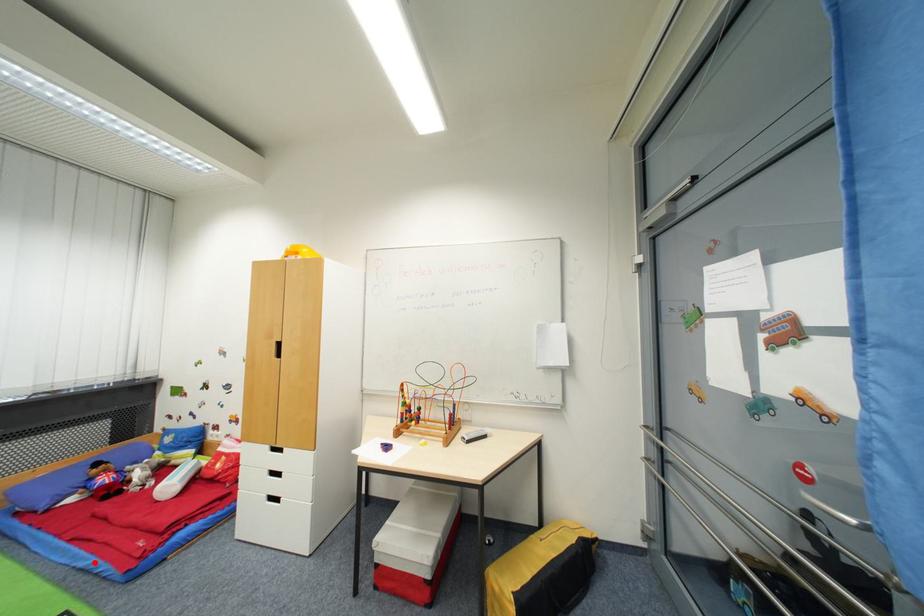
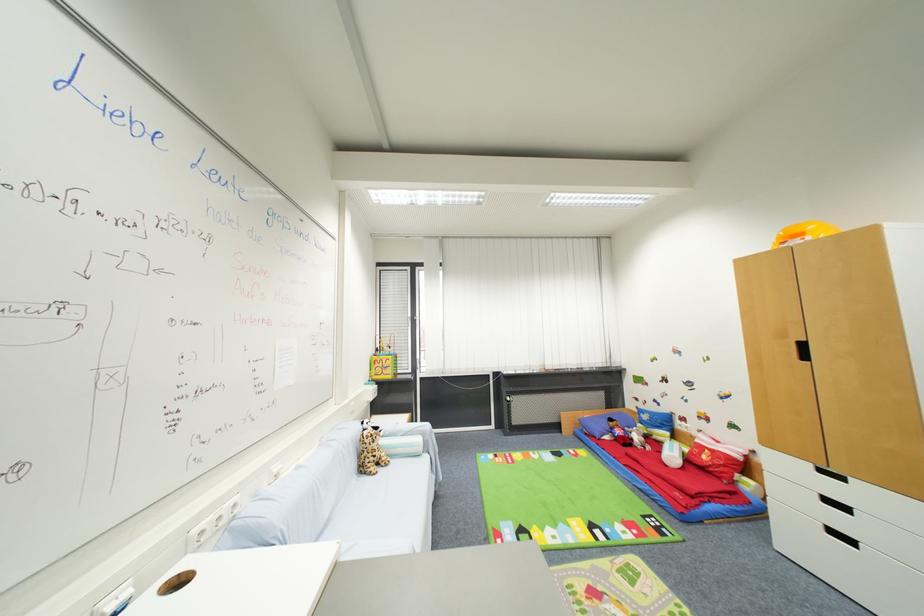
Question: I am providing you with two images of the same scene from different viewpoints. A red point is marked on the first image. At the location where the point appears in image 1, is it still visible in image 2?

Choices:
 (A) Yes
 (B) No

Answer: (A)